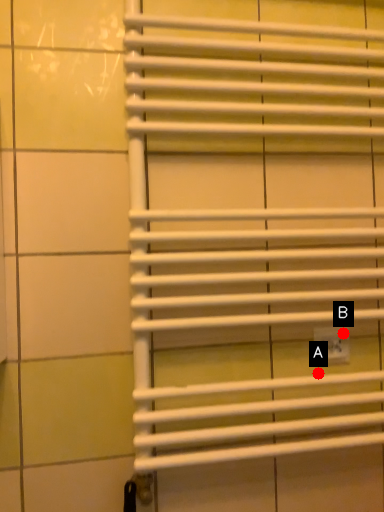
Question: Two points are circled on the image, labeled by A and B beside each circle. Which point is closer to the camera taking this photo?

Choices:
 (A) A is closer
 (B) B is closer

Answer: (A)